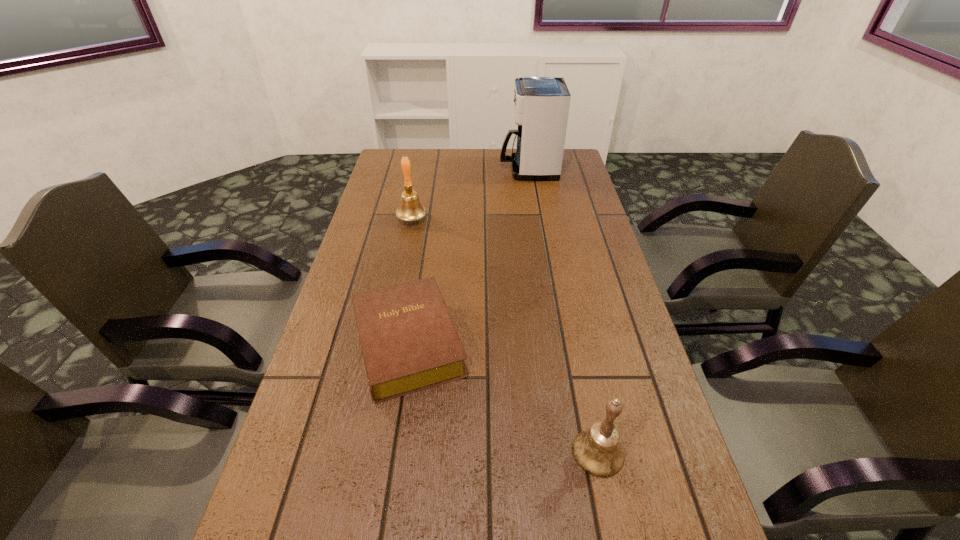
The width and height of the screenshot is (960, 540). Identify the location of vacant space that satisfies the following two spatial constraints: 1. on the front panel of the tallest object; 2. on the front side of the farther bell. (537, 219).

The width and height of the screenshot is (960, 540). In order to click on free region that satisfies the following two spatial constraints: 1. on the front panel of the third tallest object; 2. on the right side of the coffee maker in this screenshot , I will do `click(575, 452)`.

What are the coordinates of `free space that satisfies the following two spatial constraints: 1. on the front panel of the coffee maker; 2. on the front side of the second nearest object` in the screenshot? It's located at (557, 343).

Locate an element on the screen. This screenshot has width=960, height=540. vacant area in the image that satisfies the following two spatial constraints: 1. on the front side of the nearest object; 2. on the left side of the second farthest object is located at coordinates (366, 452).